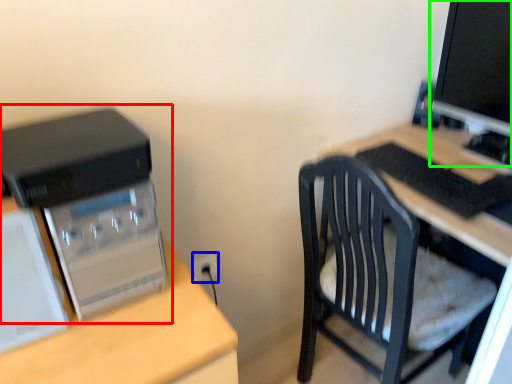
Question: Which is farther away from computer tower (highlighted by a red box)? electric outlet (highlighted by a blue box) or computer monitor (highlighted by a green box)?

Choices:
 (A) electric outlet
 (B) computer monitor

Answer: (B)